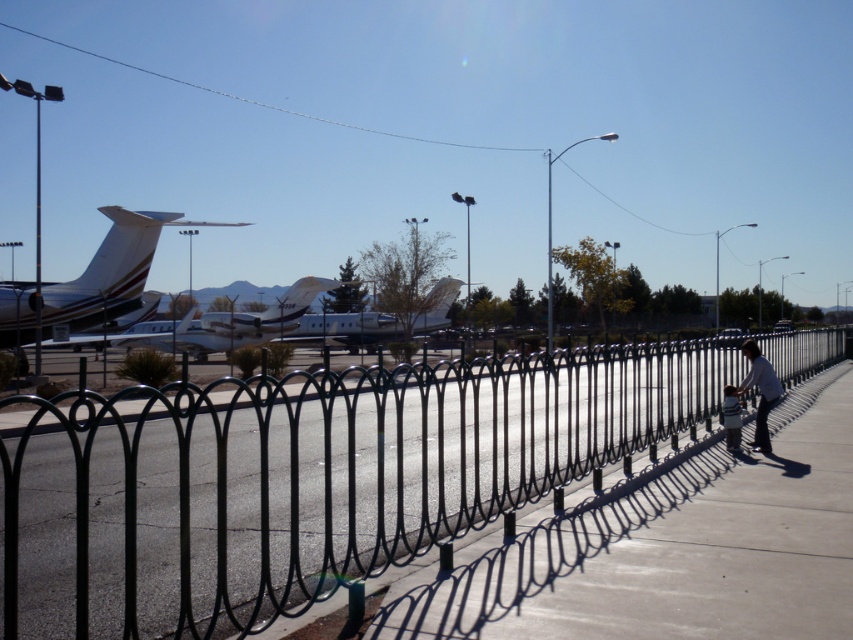
Between black wrought iron fence at center and white glossy airplane at left, which one appears on the left side from the viewer's perspective?

From the viewer's perspective, white glossy airplane at left appears more on the left side.

Which is above, black wrought iron fence at center or white glossy airplane at left?

white glossy airplane at left is above.

Find the location of a particular element. black wrought iron fence at center is located at coordinates (305, 477).

You are a GUI agent. You are given a task and a screenshot of the screen. Output one action in this format:
    pyautogui.click(x=<x>, y=<y>)
    Task: Click on the black wrought iron fence at center
    The image size is (853, 640).
    Given the screenshot: What is the action you would take?
    pyautogui.click(x=305, y=477)

Identify the location of white glossy airplane at center. The image size is (853, 640). (350, 326).

Who is taller, black wrought iron fence at center or light blue shirt at right?

Standing taller between the two is black wrought iron fence at center.

Does black wrought iron fence at center appear over light blue shirt at right?

Actually, black wrought iron fence at center is below light blue shirt at right.

The image size is (853, 640). I want to click on black wrought iron fence at center, so click(x=305, y=477).

Locate an element on the screen. Image resolution: width=853 pixels, height=640 pixels. black wrought iron fence at center is located at coordinates (305, 477).